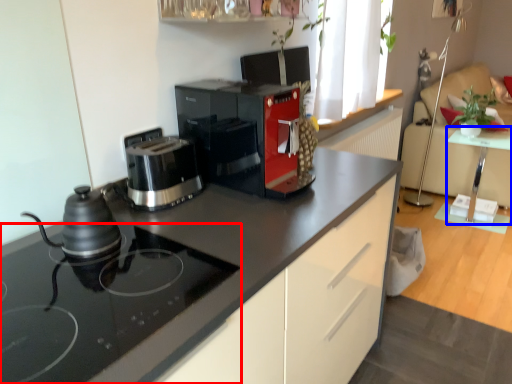
Question: Which of the following is the closest to the observer, home appliance (highlighted by a red box) or table (highlighted by a blue box)?

Choices:
 (A) home appliance
 (B) table

Answer: (A)